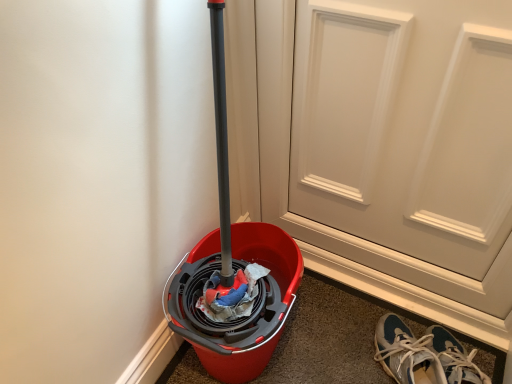
Where is `blank space to the left of blue suede sneakers at lower right`? Image resolution: width=512 pixels, height=384 pixels. blank space to the left of blue suede sneakers at lower right is located at coordinates (333, 354).